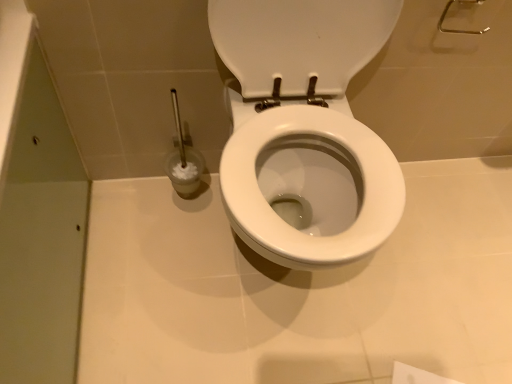
Locate an element on the screen. vacant space to the right of clear plastic brush at left is located at coordinates (212, 210).